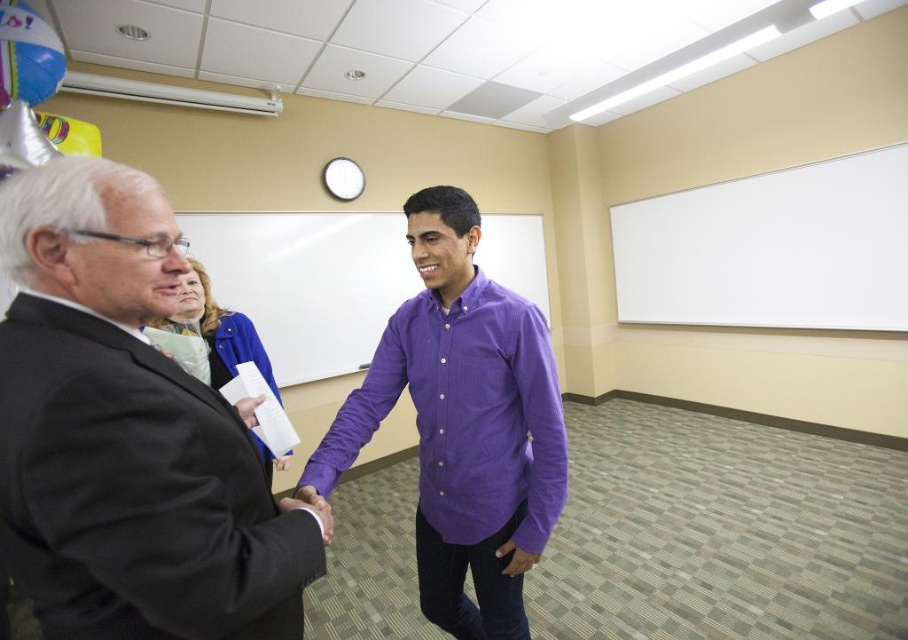
Can you confirm if black suit at left is positioned above purple cotton shirt at center?

Yes.

Can you confirm if black suit at left is smaller than purple cotton shirt at center?

Yes, black suit at left is smaller than purple cotton shirt at center.

The height and width of the screenshot is (640, 908). What do you see at coordinates (127, 433) in the screenshot?
I see `black suit at left` at bounding box center [127, 433].

Identify the location of black suit at left. (127, 433).

Is purple cotton shirt at center taller than purple shirt at center?

No, purple cotton shirt at center is not taller than purple shirt at center.

Which is more to the right, purple cotton shirt at center or purple shirt at center?

purple cotton shirt at center is more to the right.

Between point (415, 353) and point (369, 301), which one is positioned in front?

Point (415, 353) is more forward.

Where is `purple cotton shirt at center`? The image size is (908, 640). purple cotton shirt at center is located at coordinates (464, 413).

Which is more to the right, black suit at left or purple shirt at center?

black suit at left

Between black suit at left and purple shirt at center, which one has more height?

purple shirt at center

Locate an element on the screen. This screenshot has width=908, height=640. black suit at left is located at coordinates (127, 433).

Find the location of a particular element. The height and width of the screenshot is (640, 908). black suit at left is located at coordinates (127, 433).